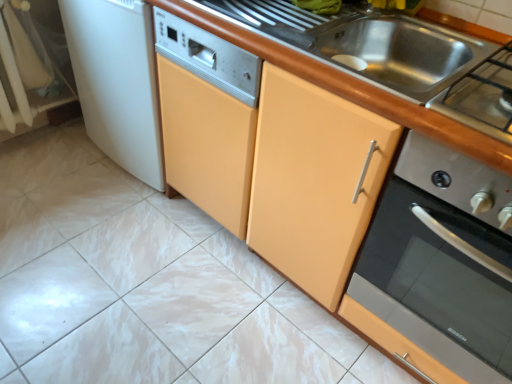
Question: Can you confirm if metallic stainless steel sink at upper center is shorter than stainless steel gas stove at upper right?

Choices:
 (A) no
 (B) yes

Answer: (A)

Question: Can you confirm if metallic stainless steel sink at upper center is bigger than stainless steel gas stove at upper right?

Choices:
 (A) no
 (B) yes

Answer: (B)

Question: From a real-world perspective, is metallic stainless steel sink at upper center on stainless steel gas stove at upper right?

Choices:
 (A) yes
 (B) no

Answer: (B)

Question: Can you confirm if metallic stainless steel sink at upper center is thinner than stainless steel gas stove at upper right?

Choices:
 (A) yes
 (B) no

Answer: (B)

Question: Is metallic stainless steel sink at upper center at the right side of stainless steel gas stove at upper right?

Choices:
 (A) yes
 (B) no

Answer: (B)

Question: Is white glossy ceramic tile at center taller or shorter than metallic stainless steel sink at upper center?

Choices:
 (A) tall
 (B) short

Answer: (B)

Question: From a real-world perspective, relative to metallic stainless steel sink at upper center, is white glossy ceramic tile at center vertically above or below?

Choices:
 (A) above
 (B) below

Answer: (B)

Question: Considering their positions, is white glossy ceramic tile at center located in front of or behind metallic stainless steel sink at upper center?

Choices:
 (A) behind
 (B) front

Answer: (B)

Question: From the image's perspective, relative to metallic stainless steel sink at upper center, is white glossy ceramic tile at center above or below?

Choices:
 (A) below
 (B) above

Answer: (A)

Question: In terms of size, does wooden at center appear bigger or smaller than white glossy ceramic tile at center?

Choices:
 (A) small
 (B) big

Answer: (B)

Question: Is wooden at center to the left or to the right of white glossy ceramic tile at center in the image?

Choices:
 (A) right
 (B) left

Answer: (A)

Question: Is wooden at center inside the boundaries of white glossy ceramic tile at center, or outside?

Choices:
 (A) inside
 (B) outside

Answer: (B)

Question: From a real-world perspective, is wooden at center physically located above or below white glossy ceramic tile at center?

Choices:
 (A) below
 (B) above

Answer: (B)

Question: Considering the relative positions of white glossy ceramic tile at center and stainless steel oven at right, the first home appliance viewed from the right, in the image provided, is white glossy ceramic tile at center to the left or to the right of stainless steel oven at right, the first home appliance viewed from the right,?

Choices:
 (A) right
 (B) left

Answer: (B)

Question: Based on their sizes in the image, would you say white glossy ceramic tile at center is bigger or smaller than stainless steel oven at right, the first home appliance viewed from the right?

Choices:
 (A) big
 (B) small

Answer: (B)